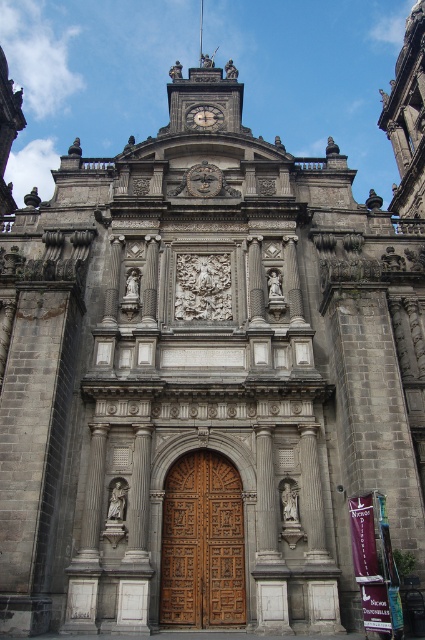
Question: Which point appears closest to the camera in this image?

Choices:
 (A) (214, 566)
 (B) (193, 116)
 (C) (206, 177)

Answer: (A)

Question: Which of the following is the farthest from the observer?

Choices:
 (A) white stone clock at center
 (B) wooden carved door at center
 (C) silver metallic clock at upper center

Answer: (C)

Question: Is wooden carved door at center above silver metallic clock at upper center?

Choices:
 (A) yes
 (B) no

Answer: (B)

Question: Is wooden carved door at center closer to the viewer compared to white stone clock at center?

Choices:
 (A) no
 (B) yes

Answer: (B)

Question: Which of the following is the closest to the observer?

Choices:
 (A) wooden carved door at center
 (B) silver metallic clock at upper center

Answer: (A)

Question: Does wooden carved door at center appear on the left side of silver metallic clock at upper center?

Choices:
 (A) yes
 (B) no

Answer: (B)